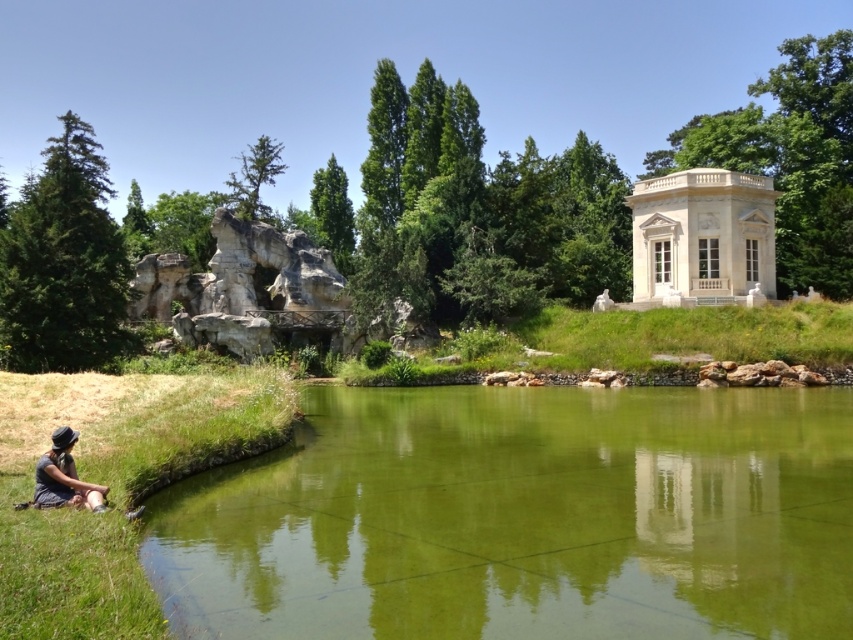
Question: Is white marble pavilion at upper right thinner than matte black hat at lower left?

Choices:
 (A) yes
 (B) no

Answer: (B)

Question: Which object is positioned closest to the matte black hat at lower left?

Choices:
 (A) white marble pavilion at upper right
 (B) green smooth water at center

Answer: (B)

Question: Which point appears closest to the camera in this image?

Choices:
 (A) coord(94,493)
 (B) coord(492,442)
 (C) coord(734,241)

Answer: (A)

Question: Among these objects, which one is nearest to the camera?

Choices:
 (A) green smooth water at center
 (B) white marble pavilion at upper right

Answer: (A)

Question: Can you confirm if green smooth water at center is wider than matte black hat at lower left?

Choices:
 (A) yes
 (B) no

Answer: (A)

Question: Does white marble pavilion at upper right appear under matte black hat at lower left?

Choices:
 (A) yes
 (B) no

Answer: (B)